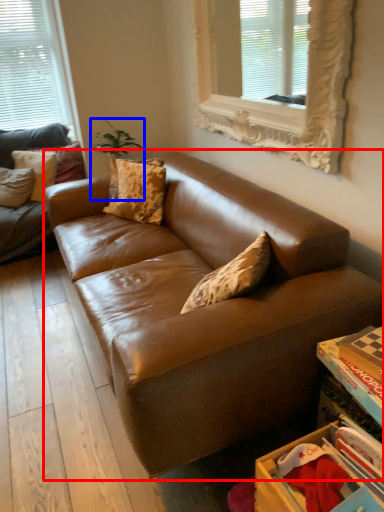
Question: Which object appears closest to the camera in this image, studio couch (highlighted by a red box) or plant (highlighted by a blue box)?

Choices:
 (A) studio couch
 (B) plant

Answer: (A)